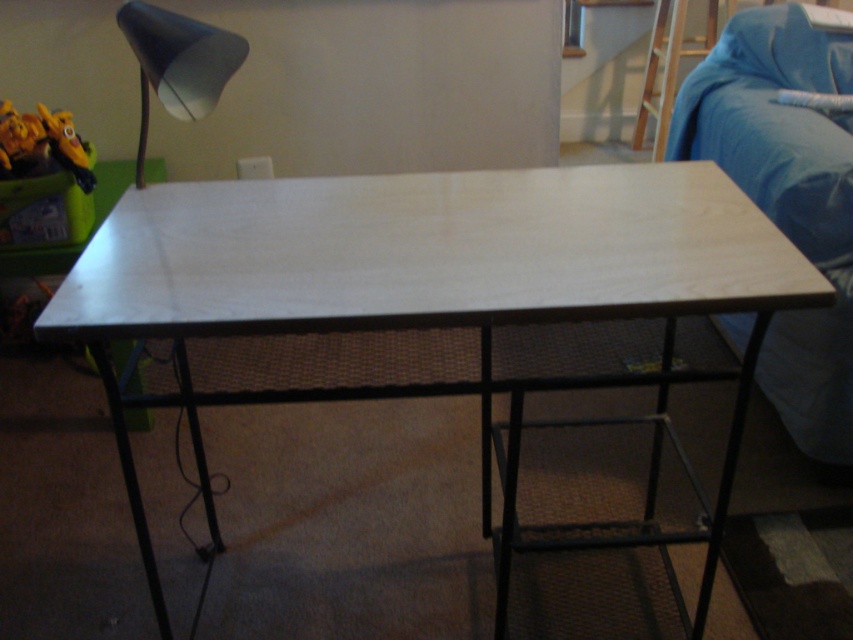
Question: Is bare wood table at center above matte black lampshade at upper left?

Choices:
 (A) yes
 (B) no

Answer: (B)

Question: Is bare wood table at center below matte black lampshade at upper left?

Choices:
 (A) yes
 (B) no

Answer: (A)

Question: Based on their relative distances, which object is farther from the matte black lampshade at upper left?

Choices:
 (A) wooden stool at upper right
 (B) bare wood table at center

Answer: (A)

Question: Can you confirm if blue fabric couch at right is smaller than matte black lampshade at upper left?

Choices:
 (A) yes
 (B) no

Answer: (B)

Question: Among these points, which one is farthest from the camera?

Choices:
 (A) (160, 188)
 (B) (666, 109)
 (C) (239, 58)

Answer: (B)

Question: Estimate the real-world distances between objects in this image. Which object is farther from the wooden stool at upper right?

Choices:
 (A) matte black lampshade at upper left
 (B) bare wood table at center
 (C) blue fabric couch at right

Answer: (A)